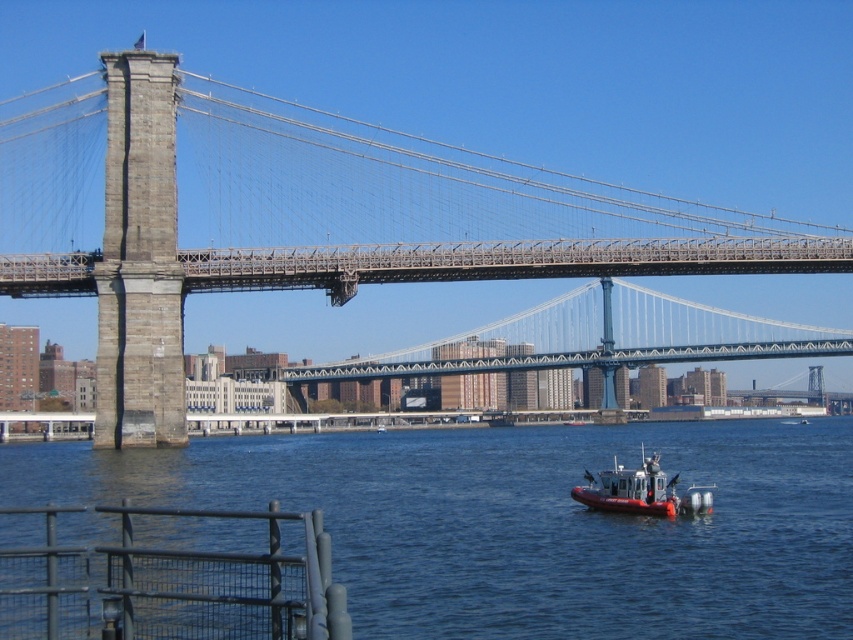
Question: Which point is farther to the camera?

Choices:
 (A) (537, 250)
 (B) (630, 486)
 (C) (328, 524)

Answer: (A)

Question: Where is blue water at lower center located in relation to stone bridge at center in the image?

Choices:
 (A) right
 (B) left

Answer: (B)

Question: In this image, where is stone bridge at center located relative to red rubber boat at center?

Choices:
 (A) above
 (B) below

Answer: (A)

Question: Among these points, which one is nearest to the camera?

Choices:
 (A) (303, 456)
 (B) (692, 515)

Answer: (B)

Question: Among these points, which one is farthest from the camera?

Choices:
 (A) (584, 470)
 (B) (106, 179)

Answer: (B)

Question: Is stone bridge at center further to the viewer compared to red rubber boat at center?

Choices:
 (A) yes
 (B) no

Answer: (A)